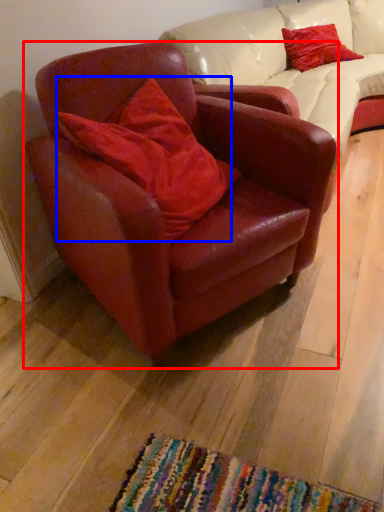
Question: Which of the following is the farthest to the observer, chair (highlighted by a red box) or pillow (highlighted by a blue box)?

Choices:
 (A) chair
 (B) pillow

Answer: (B)